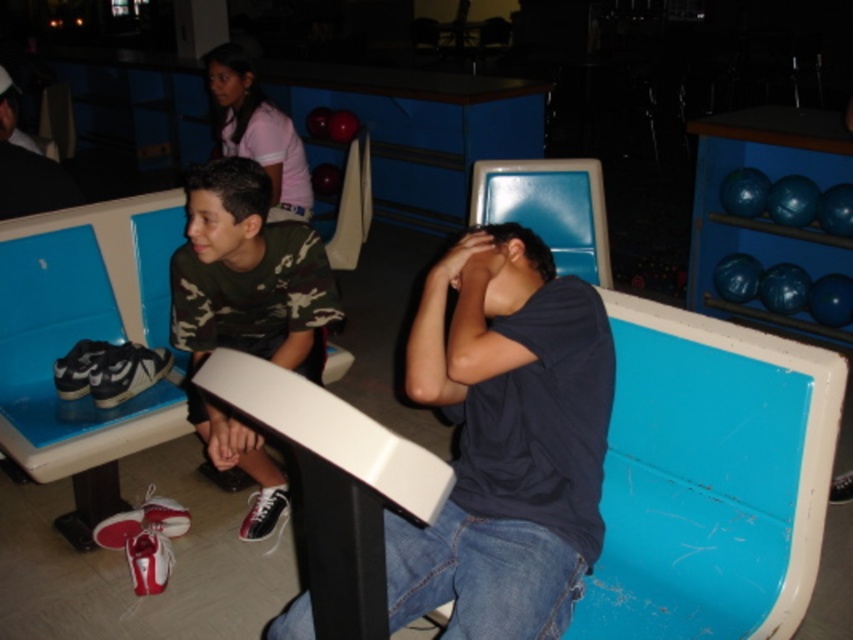
Question: Which of these objects is positioned closest to the dark blue t-shirt at center?

Choices:
 (A) camo fabric shirt at center
 (B) matte black shirt at center

Answer: (A)

Question: Does dark blue t-shirt at center appear over camo fabric shirt at center?

Choices:
 (A) no
 (B) yes

Answer: (A)

Question: Is dark blue t-shirt at center positioned in front of matte black shirt at center?

Choices:
 (A) no
 (B) yes

Answer: (B)

Question: Which point is farther from the camera taking this photo?

Choices:
 (A) (524, 467)
 (B) (202, 301)
 (C) (4, 68)

Answer: (C)

Question: Observing the image, what is the correct spatial positioning of camo fabric shirt at center in reference to matte black shirt at center?

Choices:
 (A) above
 (B) below

Answer: (B)

Question: Based on their relative distances, which object is nearer to the camo fabric shirt at center?

Choices:
 (A) matte black shirt at center
 (B) dark blue t-shirt at center

Answer: (B)